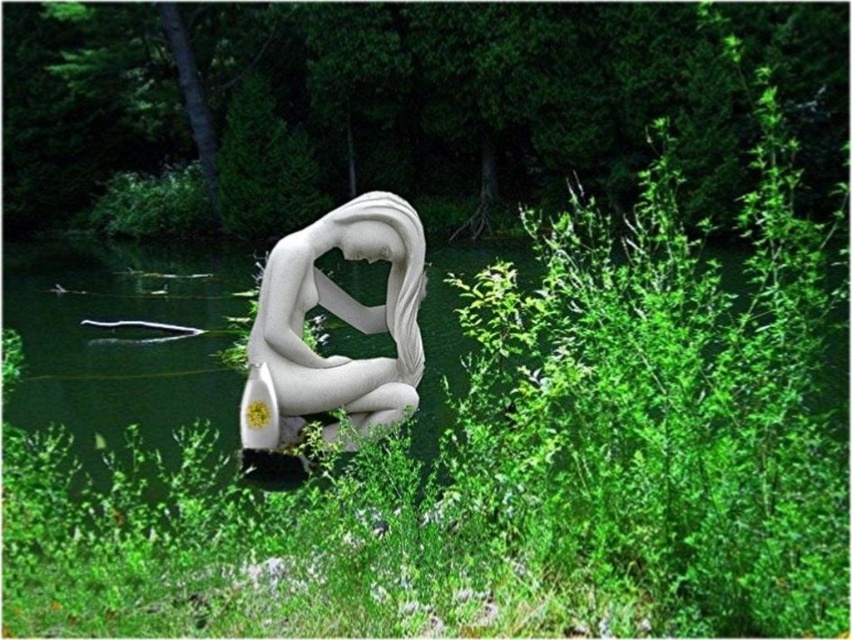
Question: Is green leafy shrubs at center positioned in front of white marble statue at center?

Choices:
 (A) yes
 (B) no

Answer: (B)

Question: Considering the relative positions of green leafy shrubs at center and white marble statue at center in the image provided, where is green leafy shrubs at center located with respect to white marble statue at center?

Choices:
 (A) above
 (B) below

Answer: (A)

Question: Which of the following is the closest to the observer?

Choices:
 (A) white marble statue at center
 (B) green leafy shrubs at center

Answer: (A)

Question: Which point is closer to the camera taking this photo?

Choices:
 (A) (360, 384)
 (B) (376, 152)

Answer: (A)

Question: Can you confirm if green leafy shrubs at center is smaller than white marble statue at center?

Choices:
 (A) no
 (B) yes

Answer: (A)